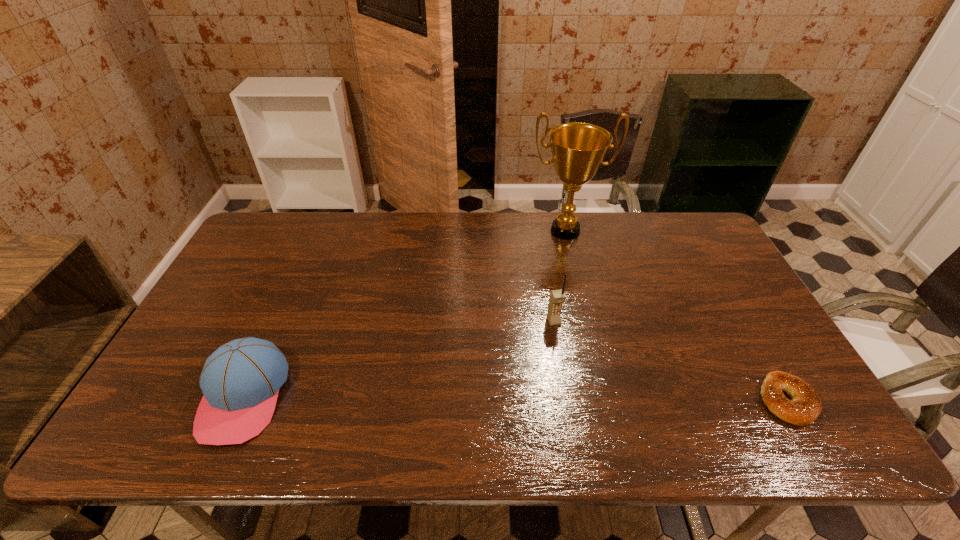
Identify the location of object that is at the near left corner. (240, 381).

This screenshot has height=540, width=960. Identify the location of object located in the near right corner section of the desktop. (804, 408).

Locate an element on the screen. The image size is (960, 540). vacant space at the far edge is located at coordinates (348, 214).

The height and width of the screenshot is (540, 960). I want to click on vacant space at the near edge, so click(x=553, y=383).

At what (x,y) coordinates should I click in order to perform the action: click on free space at the left edge of the desktop. Please return your answer as a coordinate pair (x, y). This screenshot has width=960, height=540. Looking at the image, I should click on (228, 269).

I want to click on free space at the right edge of the desktop, so click(786, 361).

Locate an element on the screen. This screenshot has width=960, height=540. free location at the near left corner of the desktop is located at coordinates (180, 394).

Find the location of a particular element. The height and width of the screenshot is (540, 960). vacant region at the far right corner of the desktop is located at coordinates (687, 224).

The height and width of the screenshot is (540, 960). Find the location of `unoccupied area between the third tallest object and the cellular telephone`. unoccupied area between the third tallest object and the cellular telephone is located at coordinates (399, 359).

Image resolution: width=960 pixels, height=540 pixels. Identify the location of vacant space in between the tallest object and the bagel. (676, 316).